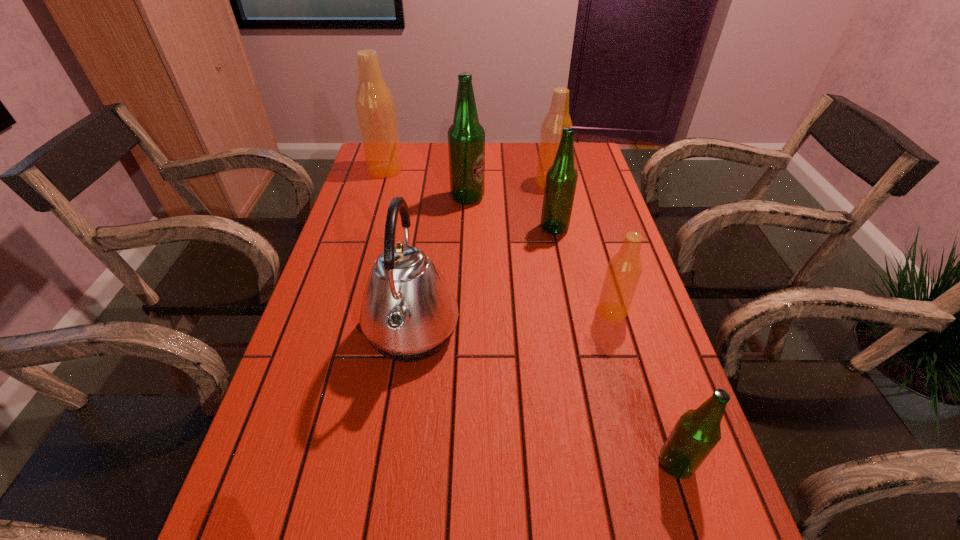
Where is `the nearest tan beer bottle`? Image resolution: width=960 pixels, height=540 pixels. the nearest tan beer bottle is located at coordinates (624, 270).

Locate an element on the screen. This screenshot has height=540, width=960. the fifth farthest beer bottle is located at coordinates (624, 270).

This screenshot has height=540, width=960. Find the location of `free space located 0.320m on the label of the second beer bottle from left to right`. free space located 0.320m on the label of the second beer bottle from left to right is located at coordinates (587, 198).

You are a GUI agent. You are given a task and a screenshot of the screen. Output one action in this format:
    pyautogui.click(x=<x>, y=<y>)
    Task: Click on the vacant space located on the right of the biggest tan beer bottle
    
    Given the screenshot: What is the action you would take?
    pyautogui.click(x=509, y=170)

The width and height of the screenshot is (960, 540). I want to click on blank space located 0.330m from the spout of the kettle, so click(x=606, y=333).

Locate an element on the screen. The height and width of the screenshot is (540, 960). vacant space located 0.130m on the left of the second biggest tan beer bottle is located at coordinates [496, 183].

Find the location of a particular element. free space located 0.160m on the label of the fourth nearest object is located at coordinates (485, 228).

At what (x,y) coordinates should I click in order to perform the action: click on vacant space located on the label of the fourth nearest object. Please return your answer as a coordinate pair (x, y). This screenshot has height=540, width=960. Looking at the image, I should click on (516, 228).

I want to click on vacant space located 0.160m on the label of the fourth nearest object, so click(485, 228).

Locate an element on the screen. blank area located on the label of the smallest green beer bottle is located at coordinates (590, 464).